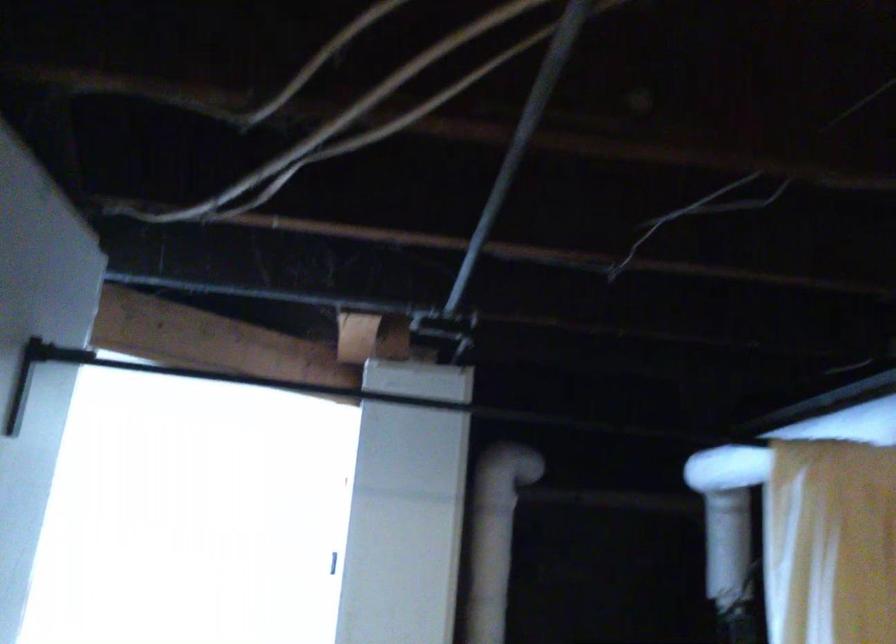
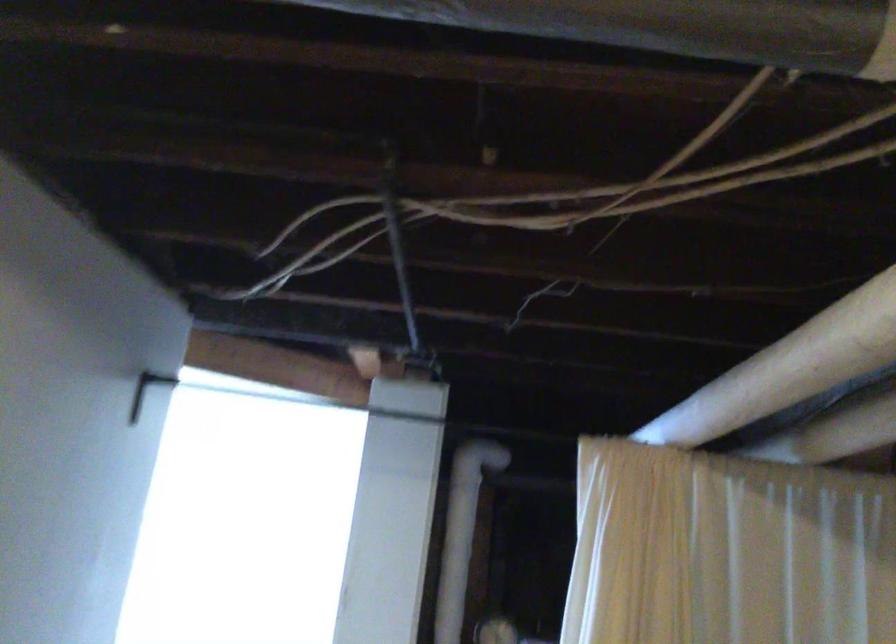
In a continuous first-person perspective shot, in which direction is the camera moving?

The cameraman walked toward right, backward.